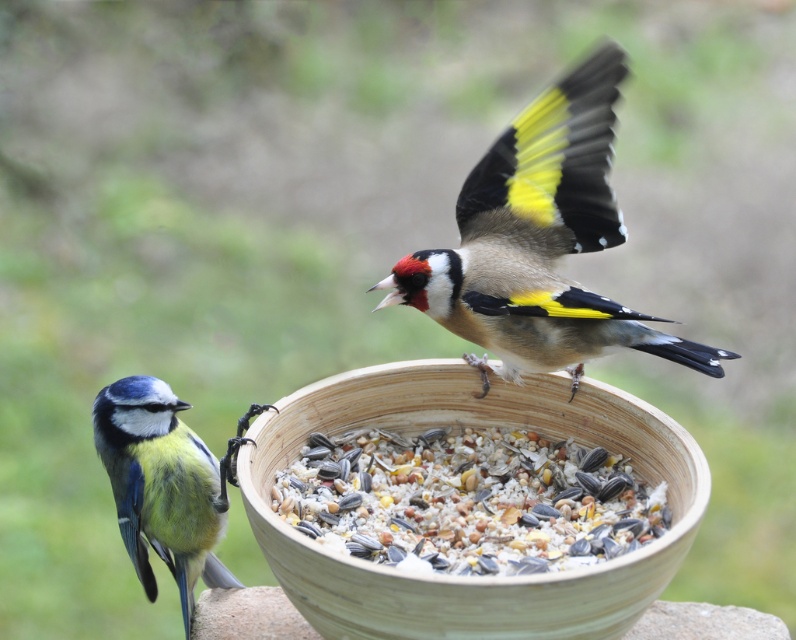
Question: Estimate the real-world distances between objects in this image. Which object is farther from the wooden bowl at center?

Choices:
 (A) multicolored seeds at center
 (B) blue-green feathers at lower left
 (C) yellow-black feathers bird at upper right

Answer: (B)

Question: Which point is farther from the camera taking this photo?

Choices:
 (A) (291, 444)
 (B) (517, 444)

Answer: (B)

Question: Does multicolored seeds at center have a larger size compared to blue-green feathers at lower left?

Choices:
 (A) yes
 (B) no

Answer: (A)

Question: Which object is farther from the camera taking this photo?

Choices:
 (A) multicolored seeds at center
 (B) blue-green feathers at lower left
 (C) wooden bowl at center

Answer: (B)

Question: Can you confirm if wooden bowl at center is thinner than multicolored seeds at center?

Choices:
 (A) yes
 (B) no

Answer: (B)

Question: Is wooden bowl at center smaller than blue-green feathers at lower left?

Choices:
 (A) no
 (B) yes

Answer: (A)